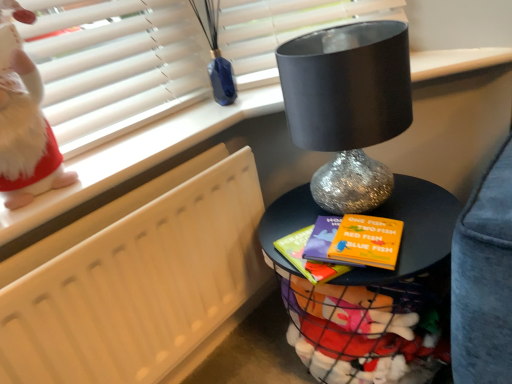
Locate an element on the screen. vacant location below white fluffy doll at upper left (from a real-world perspective) is located at coordinates tap(59, 177).